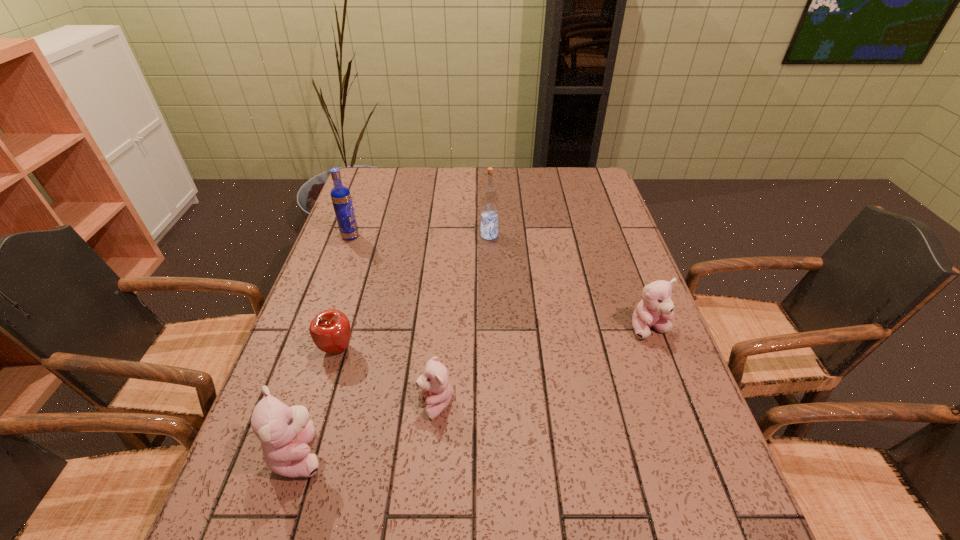
Image resolution: width=960 pixels, height=540 pixels. I want to click on vacant point located 0.060m at the face of the fourth object from left to right, so click(390, 404).

Find the location of a particular element. The height and width of the screenshot is (540, 960). free point located 0.140m at the face of the fourth object from left to right is located at coordinates click(352, 404).

At what (x,y) coordinates should I click in order to perform the action: click on blank space located 0.230m at the face of the fourth object from left to right. Please return your answer as a coordinate pair (x, y). This screenshot has width=960, height=540. Looking at the image, I should click on (310, 404).

Locate an element on the screen. Image resolution: width=960 pixels, height=540 pixels. free space located 0.130m at the face of the second shortest teddy bear is located at coordinates (673, 389).

This screenshot has height=540, width=960. I want to click on vacant space situated on the right of the second object from right to left, so click(571, 235).

Find the location of a particular element. The height and width of the screenshot is (540, 960). vacant space located 0.380m on the back of the apple is located at coordinates (370, 241).

Identify the location of vacant space situated 0.320m on the front of the left vodka. The height and width of the screenshot is (540, 960). (321, 318).

Identify the location of object positioned at the near edge. (285, 432).

This screenshot has width=960, height=540. Identify the location of teddy bear situated at the left edge. (285, 432).

Locate an element on the screen. apple at the left edge is located at coordinates (330, 330).